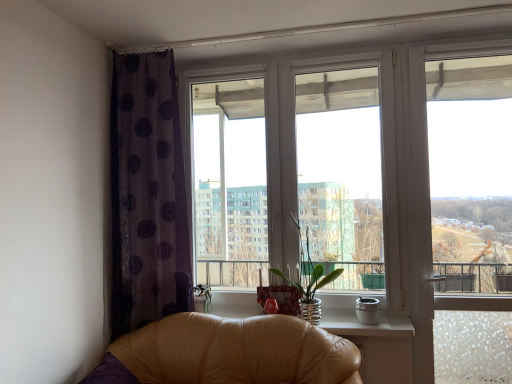
Question: Is transparent glass window at center outside purple sheer curtain at left?

Choices:
 (A) yes
 (B) no

Answer: (A)

Question: Is transparent glass window at center facing away from purple sheer curtain at left?

Choices:
 (A) yes
 (B) no

Answer: (B)

Question: Is transparent glass window at center with purple sheer curtain at left?

Choices:
 (A) no
 (B) yes

Answer: (A)

Question: Is transparent glass window at center thinner than purple sheer curtain at left?

Choices:
 (A) no
 (B) yes

Answer: (B)

Question: Considering the relative sizes of transparent glass window at center and purple sheer curtain at left in the image provided, is transparent glass window at center bigger than purple sheer curtain at left?

Choices:
 (A) yes
 (B) no

Answer: (A)

Question: Does transparent glass window at center appear on the left side of purple sheer curtain at left?

Choices:
 (A) no
 (B) yes

Answer: (A)

Question: From a real-world perspective, is clear glass window at upper right positioned over transparent glass window at center based on gravity?

Choices:
 (A) no
 (B) yes

Answer: (A)

Question: Does clear glass window at upper right have a larger size compared to transparent glass window at center?

Choices:
 (A) yes
 (B) no

Answer: (B)

Question: Is clear glass window at upper right positioned in front of transparent glass window at center?

Choices:
 (A) no
 (B) yes

Answer: (B)

Question: Is clear glass window at upper right next to transparent glass window at center and touching it?

Choices:
 (A) yes
 (B) no

Answer: (B)

Question: Does clear glass window at upper right have a greater height compared to transparent glass window at center?

Choices:
 (A) yes
 (B) no

Answer: (A)

Question: Can we say clear glass window at upper right lies outside transparent glass window at center?

Choices:
 (A) no
 (B) yes

Answer: (B)

Question: Is clear glass vase at center further to camera compared to purple sheer curtain at left?

Choices:
 (A) no
 (B) yes

Answer: (B)